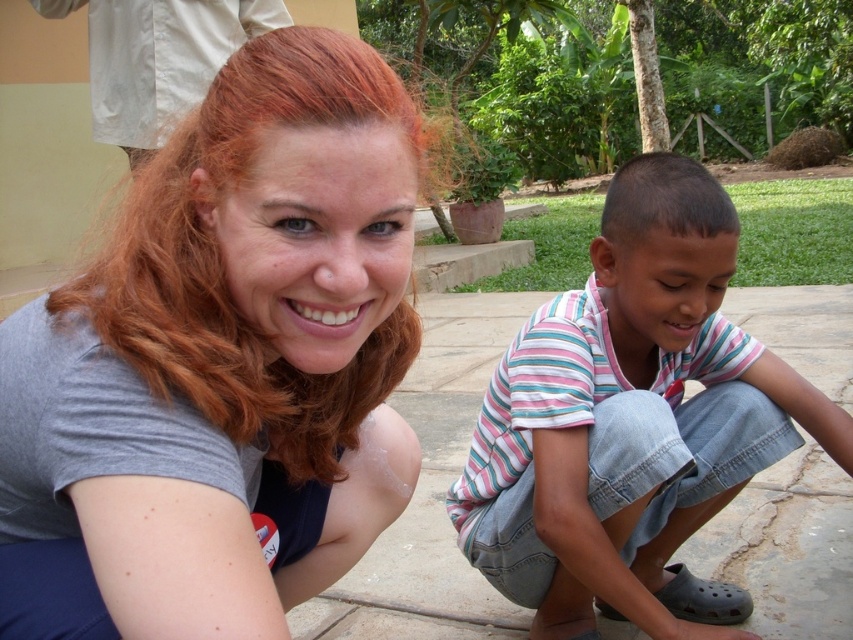
Question: Can you confirm if striped cotton shirt at lower right is thinner than white fabric at upper left?

Choices:
 (A) yes
 (B) no

Answer: (A)

Question: Which is farther from the striped cotton shirt at lower right?

Choices:
 (A) white fabric at upper left
 (B) gray matte shirt at upper left

Answer: (A)

Question: Is striped cotton shirt at lower right positioned in front of white fabric at upper left?

Choices:
 (A) no
 (B) yes

Answer: (B)

Question: Which object is the closest to the gray matte shirt at upper left?

Choices:
 (A) striped cotton shirt at lower right
 (B) white fabric at upper left

Answer: (A)

Question: Is striped cotton shirt at lower right further to camera compared to white fabric at upper left?

Choices:
 (A) yes
 (B) no

Answer: (B)

Question: Which object is positioned closest to the gray matte shirt at upper left?

Choices:
 (A) striped cotton shirt at lower right
 (B) white fabric at upper left

Answer: (A)